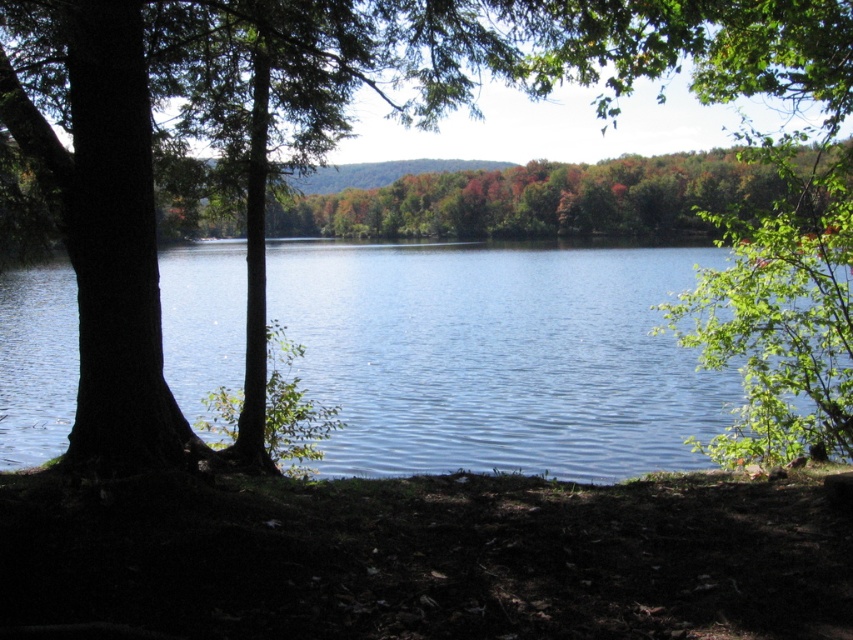
Question: Which point appears closest to the camera in this image?

Choices:
 (A) (662, 588)
 (B) (496, 433)

Answer: (A)

Question: Is dull brown dirt at lower center to the right of blue water at center from the viewer's perspective?

Choices:
 (A) no
 (B) yes

Answer: (A)

Question: Which point is farther to the camera?

Choices:
 (A) blue water at center
 (B) dull brown dirt at lower center

Answer: (A)

Question: Which point is farther from the camera taking this photo?

Choices:
 (A) (677, 554)
 (B) (614, 284)

Answer: (B)

Question: Does dull brown dirt at lower center have a lesser width compared to blue water at center?

Choices:
 (A) no
 (B) yes

Answer: (B)

Question: Can you confirm if dull brown dirt at lower center is positioned below blue water at center?

Choices:
 (A) no
 (B) yes

Answer: (B)